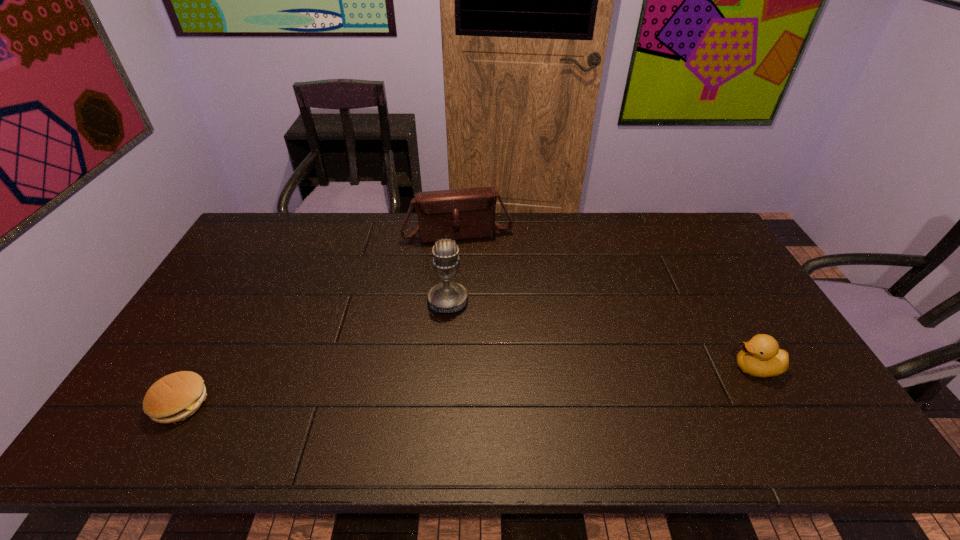
You are a GUI agent. You are given a task and a screenshot of the screen. Output one action in this format:
    pyautogui.click(x=<x>, y=<y>)
    Task: Click on the vacant space that's between the shortest object and the third shortest object
    Image resolution: width=960 pixels, height=540 pixels.
    Given the screenshot: What is the action you would take?
    pyautogui.click(x=320, y=318)

Identify the location of free space between the duckling and the third shortest object. The height and width of the screenshot is (540, 960). (607, 301).

Identify the location of free space between the duckling and the second tallest object. (607, 301).

Where is `free space that is in between the duckling and the third shortest object`? free space that is in between the duckling and the third shortest object is located at coordinates (607, 301).

The width and height of the screenshot is (960, 540). Find the location of `unoccupied area between the duckling and the patty`. unoccupied area between the duckling and the patty is located at coordinates (468, 386).

Where is `free space between the leftmost object and the third nearest object`? This screenshot has height=540, width=960. free space between the leftmost object and the third nearest object is located at coordinates (314, 352).

This screenshot has height=540, width=960. What are the coordinates of `free space between the third tallest object and the microphone` in the screenshot? It's located at (602, 335).

The width and height of the screenshot is (960, 540). I want to click on empty space that is in between the leftmost object and the microphone, so 314,352.

Where is `free space between the leftmost object and the rightmost object`? free space between the leftmost object and the rightmost object is located at coordinates (468, 386).

The height and width of the screenshot is (540, 960). Find the location of `vacant space that is in between the duckling and the farthest object`. vacant space that is in between the duckling and the farthest object is located at coordinates (607, 301).